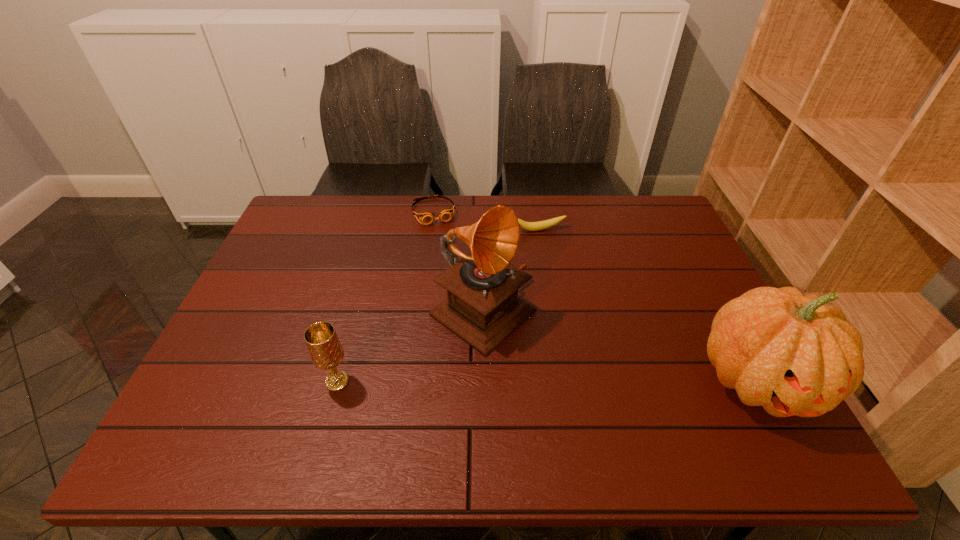
At what (x,y) coordinates should I click in order to perform the action: click on pumpkin positioned at the near edge. Please return your answer as a coordinate pair (x, y). This screenshot has width=960, height=540. Looking at the image, I should click on [x=793, y=355].

Where is `object that is at the right edge`? The image size is (960, 540). object that is at the right edge is located at coordinates (793, 355).

The width and height of the screenshot is (960, 540). Find the location of `object that is at the near right corner`. object that is at the near right corner is located at coordinates (793, 355).

Where is `free point at the far edge`? This screenshot has height=540, width=960. free point at the far edge is located at coordinates pyautogui.click(x=355, y=213).

This screenshot has height=540, width=960. In order to click on vacant point at the near edge in this screenshot , I will do `click(443, 380)`.

Locate an element on the screen. Image resolution: width=960 pixels, height=540 pixels. free space at the left edge of the desktop is located at coordinates (264, 266).

Image resolution: width=960 pixels, height=540 pixels. In the image, there is a desktop. Identify the location of vacant area at the far left corner. (305, 225).

Image resolution: width=960 pixels, height=540 pixels. In the image, there is a desktop. In order to click on vacant space at the far right corner in this screenshot , I will do `click(644, 202)`.

Find the location of `free spot between the third tallest object and the phonograph record`. free spot between the third tallest object and the phonograph record is located at coordinates (410, 347).

I want to click on vacant area between the fourth shortest object and the leftmost object, so click(x=548, y=381).